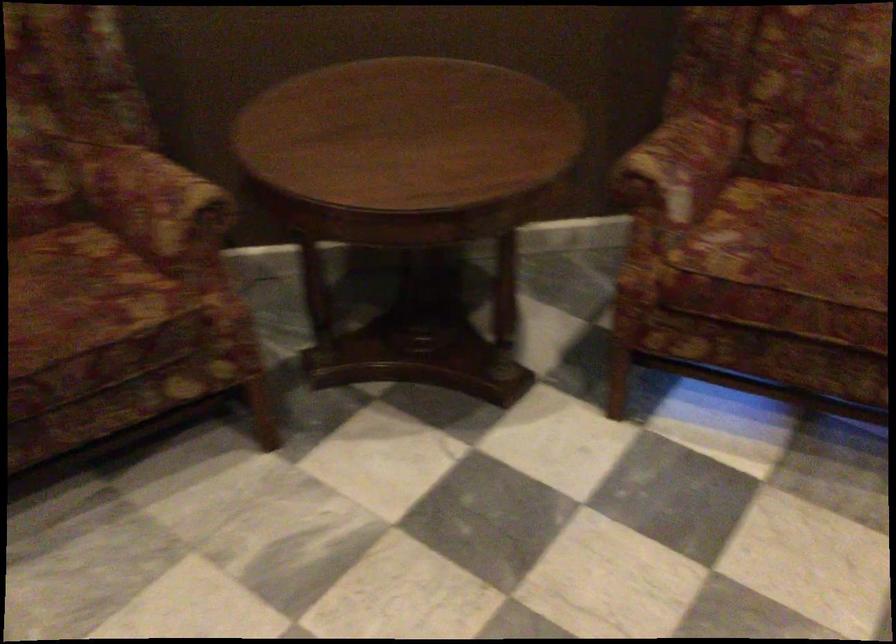
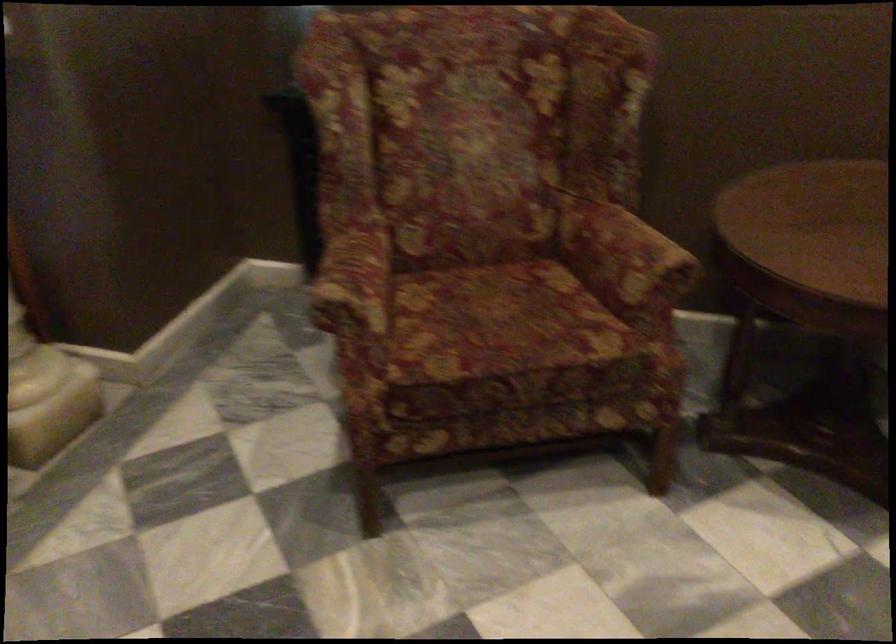
Locate, in the second image, the point that corresponds to point 151,207 in the first image.

(624, 258)